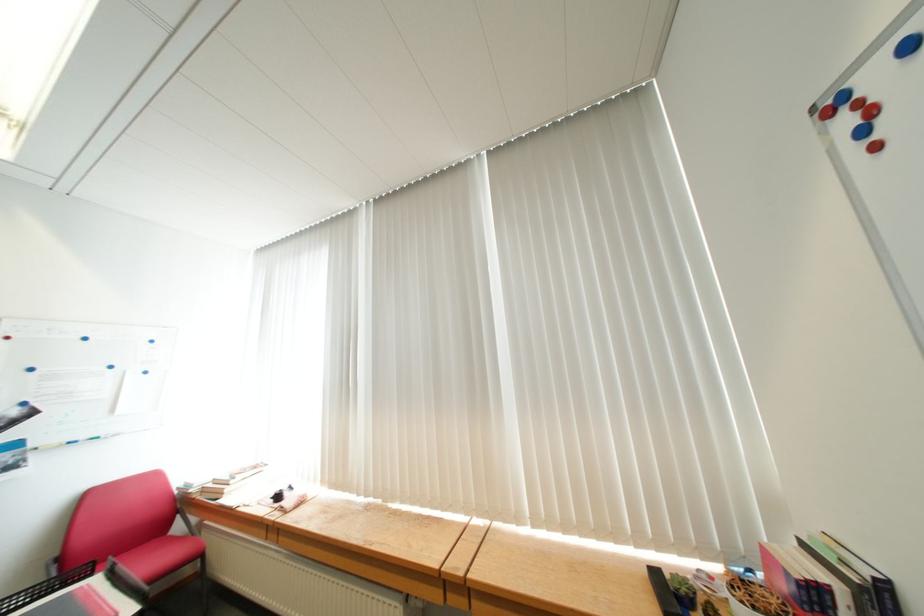
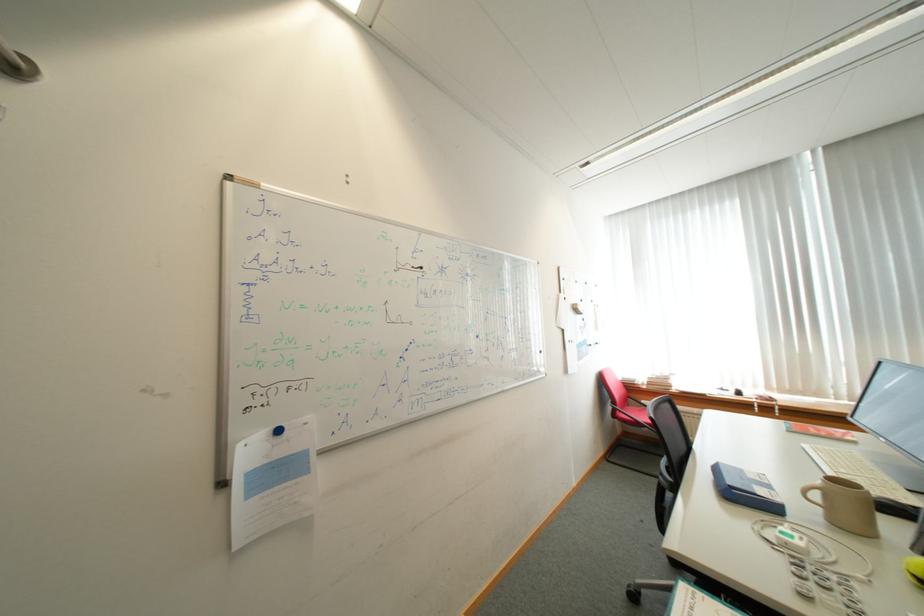
Which direction would the cameraman need to move to produce the second image?

The cameraman moved toward left, backward.